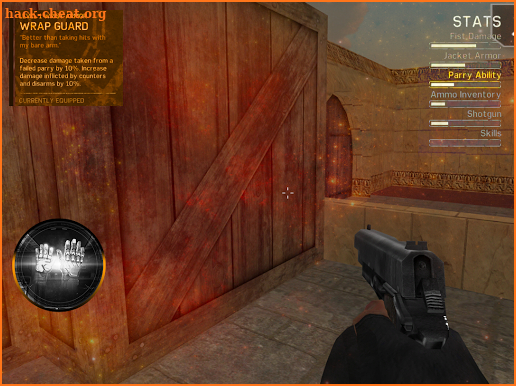
Identify the location of wood wall. Image resolution: width=516 pixels, height=386 pixels. (185, 187).